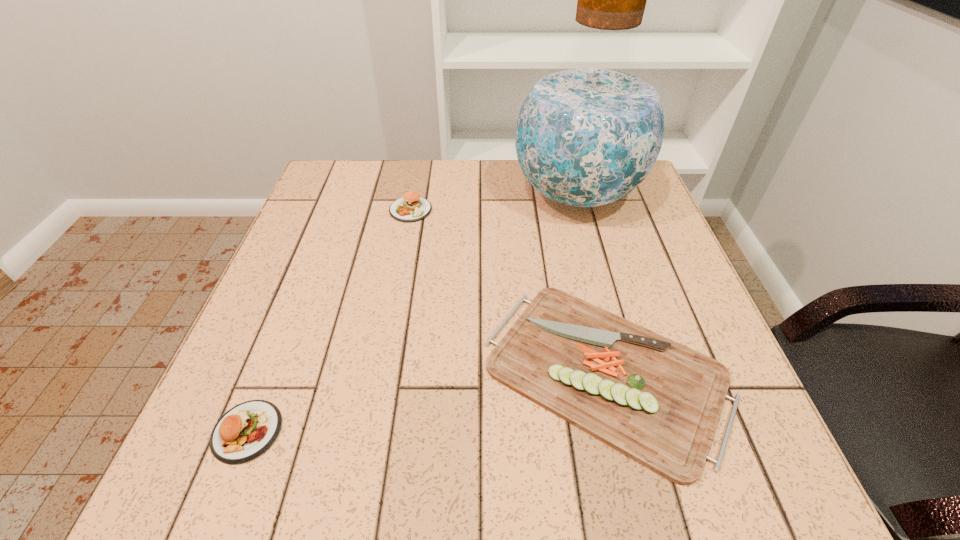
I want to click on vacant space at the far edge, so [434, 196].

In the image, there is a desktop. At what (x,y) coordinates should I click in order to perform the action: click on free space at the near edge. Please return your answer as a coordinate pair (x, y). Image resolution: width=960 pixels, height=540 pixels. Looking at the image, I should click on coord(525,485).

Locate an element on the screen. This screenshot has width=960, height=540. free spot at the left edge of the desktop is located at coordinates (314, 314).

The height and width of the screenshot is (540, 960). Identify the location of vacant area at the right edge of the desktop. (619, 253).

Identify the location of vacant space at the far left corner of the desktop. The image size is (960, 540). (342, 191).

Find the location of a particular element. vacant area at the far right corner is located at coordinates [641, 197].

Image resolution: width=960 pixels, height=540 pixels. In the image, there is a desktop. Identify the location of free space at the near right corner. [x=743, y=452].

Locate an element on the screen. vacant region between the chopping board and the right patty (food) is located at coordinates (508, 291).

This screenshot has width=960, height=540. I want to click on free space between the tallest object and the second object from left to right, so click(x=493, y=202).

Locate an element on the screen. The width and height of the screenshot is (960, 540). empty space that is in between the tallest object and the shortest object is located at coordinates (591, 283).